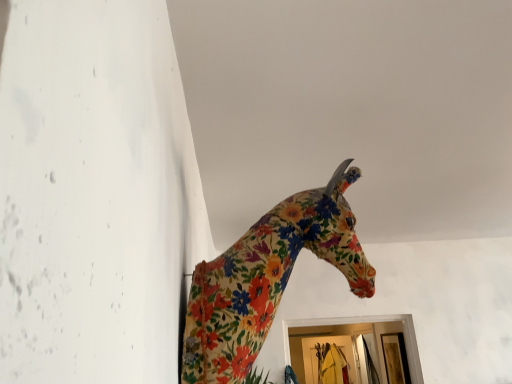
This screenshot has height=384, width=512. Find the location of `floral fabric giraffe at upper center`. floral fabric giraffe at upper center is located at coordinates (267, 278).

In order to face floral fabric giraffe at upper center, should I rotate leftwards or rightwards?

To align with it, rotate right about 4.135°.

This screenshot has width=512, height=384. Describe the element at coordinates (267, 278) in the screenshot. I see `floral fabric giraffe at upper center` at that location.

The image size is (512, 384). Identify the location of floral fabric giraffe at upper center. (267, 278).